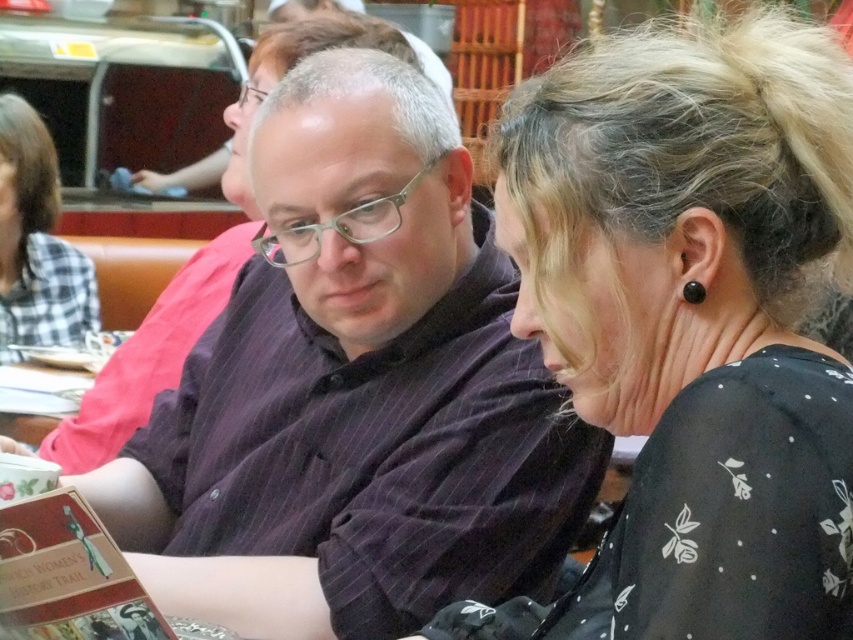
Question: Is dark pinstriped shirt at center in front of black dotted blouse at center?

Choices:
 (A) yes
 (B) no

Answer: (B)

Question: Which object is the farthest from the dark pinstriped shirt at center?

Choices:
 (A) black dotted blouse at center
 (B) plaid fabric shirt at upper left

Answer: (B)

Question: Is dark pinstriped shirt at center smaller than plaid fabric shirt at upper left?

Choices:
 (A) yes
 (B) no

Answer: (B)

Question: Which point is closer to the camera?

Choices:
 (A) (755, 625)
 (B) (0, 252)
 (C) (537, 456)

Answer: (A)

Question: Is dark pinstriped shirt at center smaller than black dotted blouse at center?

Choices:
 (A) yes
 (B) no

Answer: (B)

Question: Which point is closer to the camera?

Choices:
 (A) black dotted blouse at center
 (B) plaid fabric shirt at upper left
 (C) dark pinstriped shirt at center

Answer: (A)